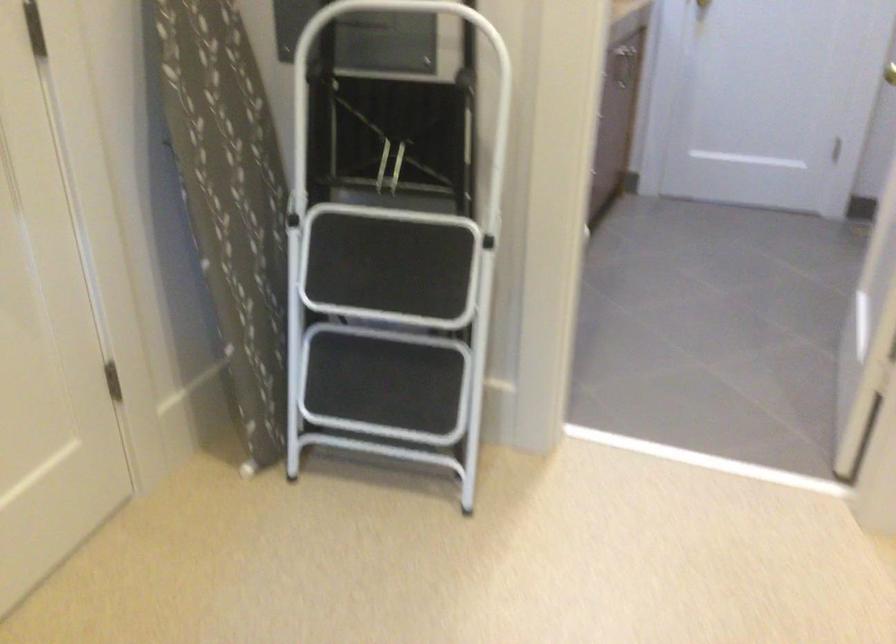
Describe the element at coordinates (378, 13) in the screenshot. The width and height of the screenshot is (896, 644). I see `the white stool handle` at that location.